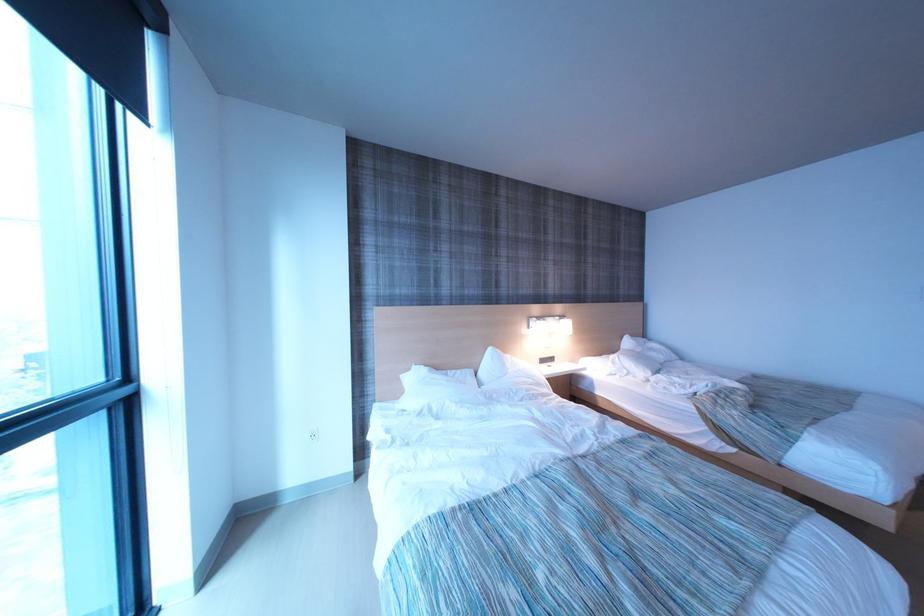
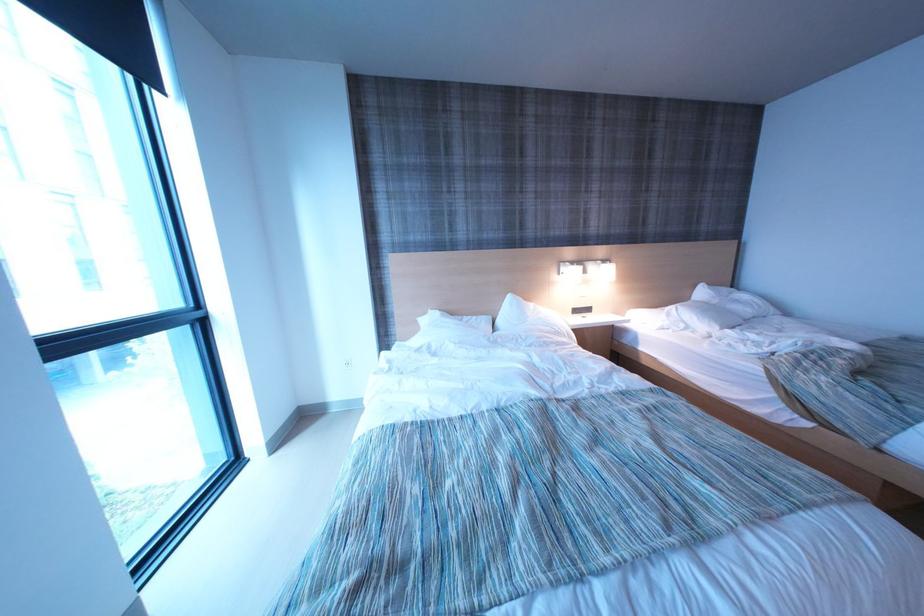
Question: In a continuous first-person perspective shot, in which direction is the camera moving?

Choices:
 (A) Left
 (B) Right
 (C) Forward
 (D) Backward

Answer: (B)